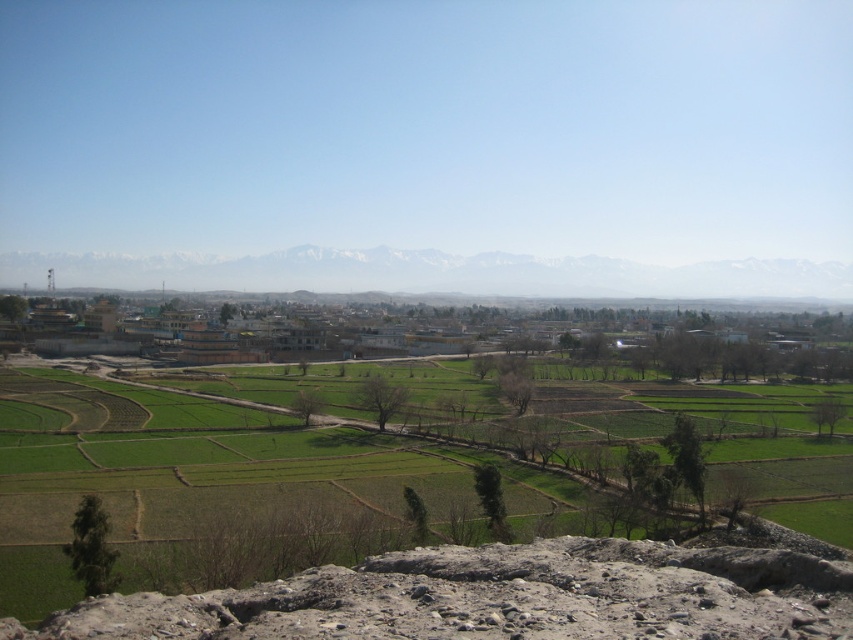
You are standing on a hill overlooking the landscape. You see the green grassland at center and the snowy white mountain at upper center. Which of these two landmarks is nearer to your current position?

The green grassland at center is closer to the viewer than the snowy white mountain at upper center, so the green grassland at center is nearer to your current position.